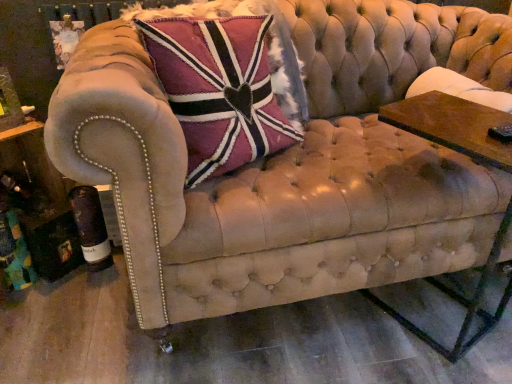
Locate an element on the screen. Image resolution: width=512 pixels, height=384 pixels. free region on the left part of wooden rectangular table at right is located at coordinates (346, 329).